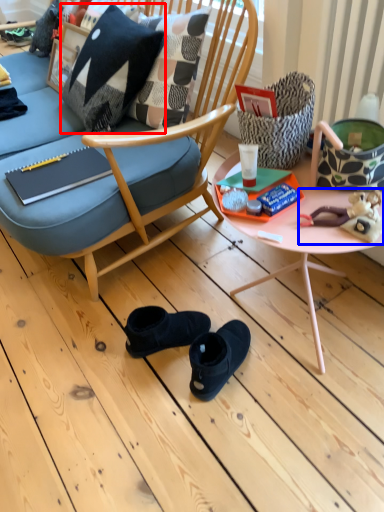
Question: Which of the following is the closest to the observer, pillow (highlighted by a red box) or stuff (highlighted by a blue box)?

Choices:
 (A) pillow
 (B) stuff

Answer: (B)